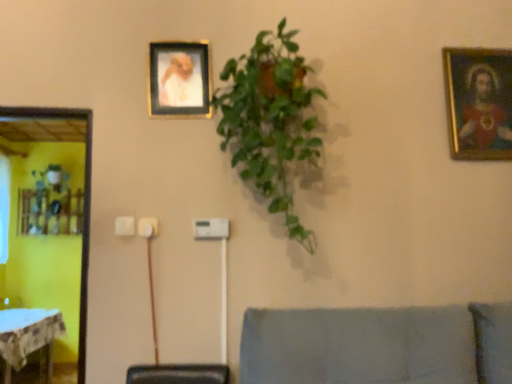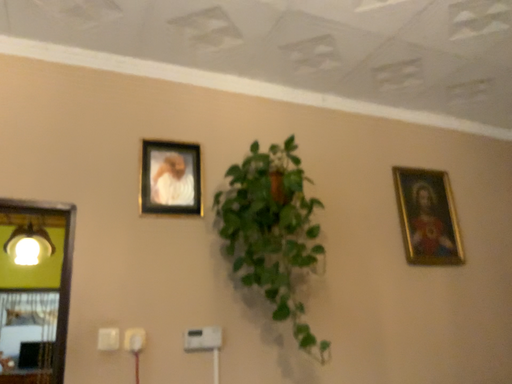
Question: How did the camera likely rotate when shooting the video?

Choices:
 (A) rotated upward
 (B) rotated downward

Answer: (A)